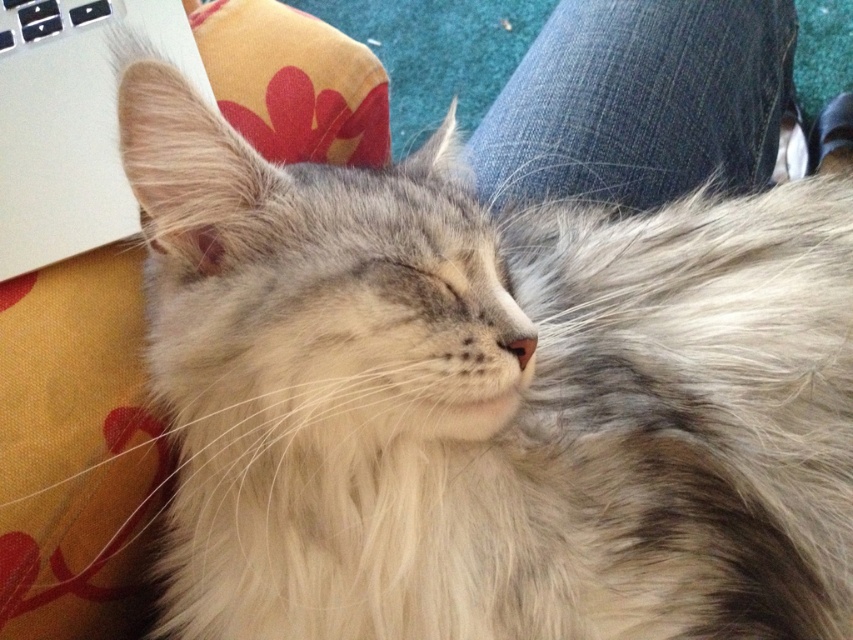
You are trying to determine if the denim at center is taller than the white plastic keyboard at upper left. Based on the scene, can you confirm this?

The denim at center is taller than the white plastic keyboard at upper left according to the description.

You are trying to decide whether to place a small plant pot between the denim at center and the silver metallic laptop at upper left. Given their sizes, will the plant pot fit in the space between them?

→ The denim at center is bigger than the silver metallic laptop at upper left, but the exact distance between them isn